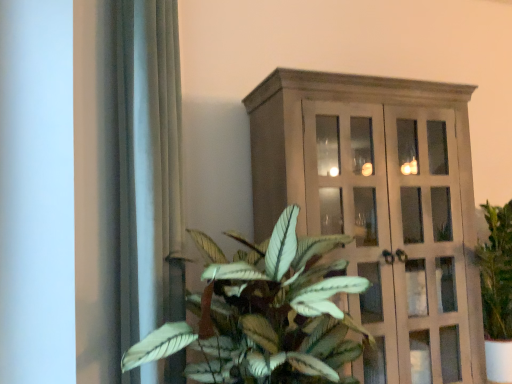
Question: Relative to satin gray curtain at left, is matte wooden cabinet at right in front or behind?

Choices:
 (A) behind
 (B) front

Answer: (A)

Question: From the image's perspective, is matte wooden cabinet at right located above or below satin gray curtain at left?

Choices:
 (A) above
 (B) below

Answer: (B)

Question: Which object is the closest to the satin gray curtain at left?

Choices:
 (A) green leafy plant at center
 (B) matte wooden cabinet at right
 (C) wooden cabinet at upper center

Answer: (A)

Question: Estimate the real-world distances between objects in this image. Which object is farther from the wooden cabinet at upper center?

Choices:
 (A) green leafy plant at center
 (B) matte wooden cabinet at right
 (C) satin gray curtain at left

Answer: (C)